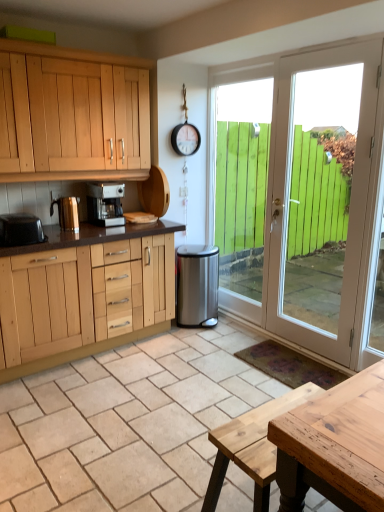
Image resolution: width=384 pixels, height=512 pixels. I want to click on vacant area on top of natural stone tile at center (from a real-world perspective), so click(x=143, y=398).